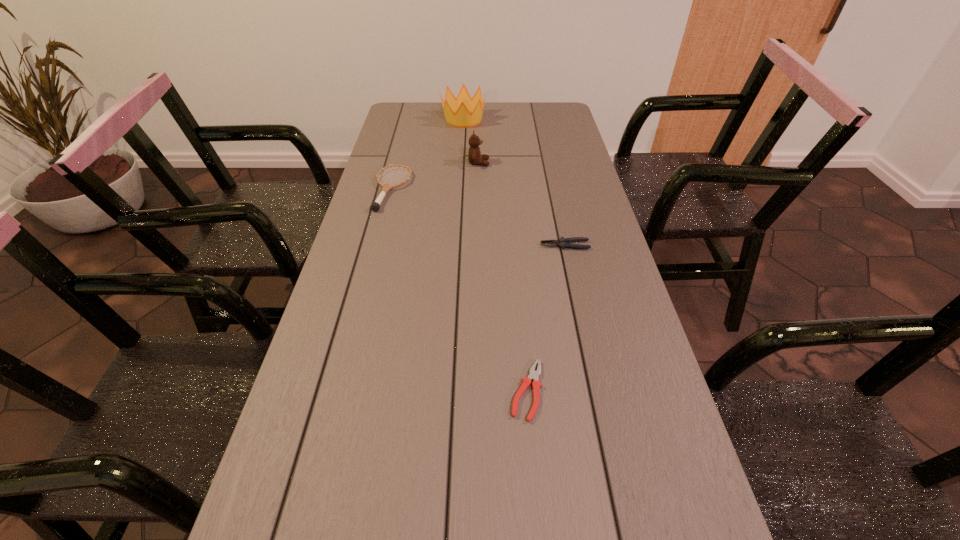
This screenshot has height=540, width=960. In order to click on vacant region located 0.050m on the right of the leftmost object in this screenshot , I will do tap(425, 190).

Find the location of a particular element. Image resolution: width=960 pixels, height=540 pixels. vacant space located 0.180m at the gripping part of the taller pliers is located at coordinates 475,245.

This screenshot has height=540, width=960. In order to click on free space located at the gripping part of the taller pliers in this screenshot , I will do `click(407, 245)`.

You are a GUI agent. You are given a task and a screenshot of the screen. Output one action in this format:
    pyautogui.click(x=<x>, y=<y>)
    Task: Click on the free space located at the gripping part of the taller pliers
    Image resolution: width=960 pixels, height=540 pixels.
    Given the screenshot: What is the action you would take?
    pyautogui.click(x=421, y=245)

In order to click on vacant space located 0.230m on the back of the nearer pliers in this screenshot , I will do `click(517, 286)`.

What are the coordinates of `object that is at the far edge` in the screenshot? It's located at (x=457, y=111).

Find the location of `object at the left edge`. object at the left edge is located at coordinates (375, 206).

Locate an element on the screen. The height and width of the screenshot is (540, 960). object that is at the right edge is located at coordinates (563, 242).

This screenshot has width=960, height=540. In order to click on free location at the left edge in this screenshot , I will do `click(370, 180)`.

Locate an element on the screen. Image resolution: width=960 pixels, height=540 pixels. vacant space at the right edge of the desktop is located at coordinates (607, 447).